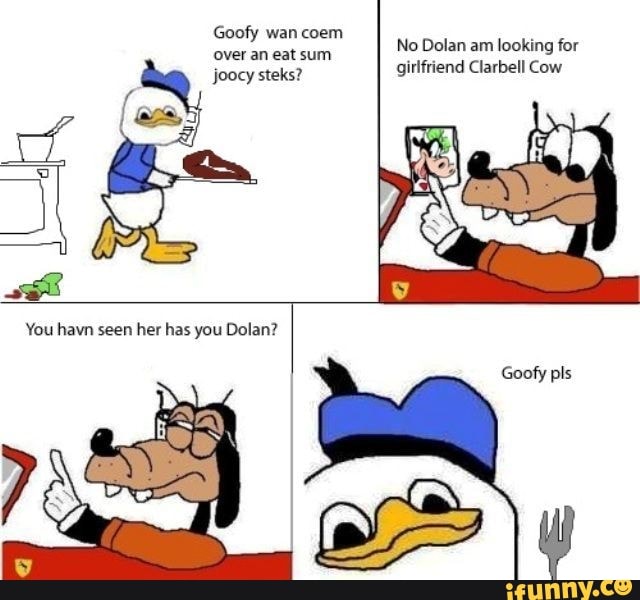
Identify the location of oven. This screenshot has width=640, height=600. (25, 200).